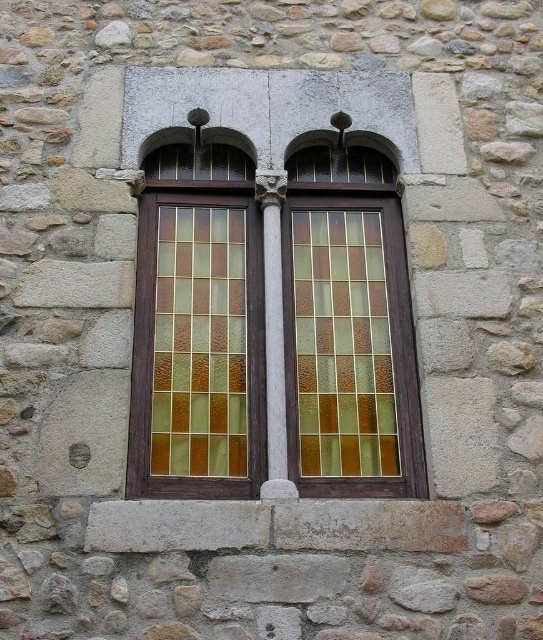
You are a painter standing 1.5 meters away from the wooden stained glass window at center. You want to paint the translucent amber tiles at center. Can you reach them without moving closer?

The distance between the wooden stained glass window at center and the translucent amber tiles at center is 2.11 meters. Since you are already 1.5 meters away from the wooden stained glass window at center, you are 0.61 meters away from the translucent amber tiles at center. Therefore, you can reach them without moving closer.